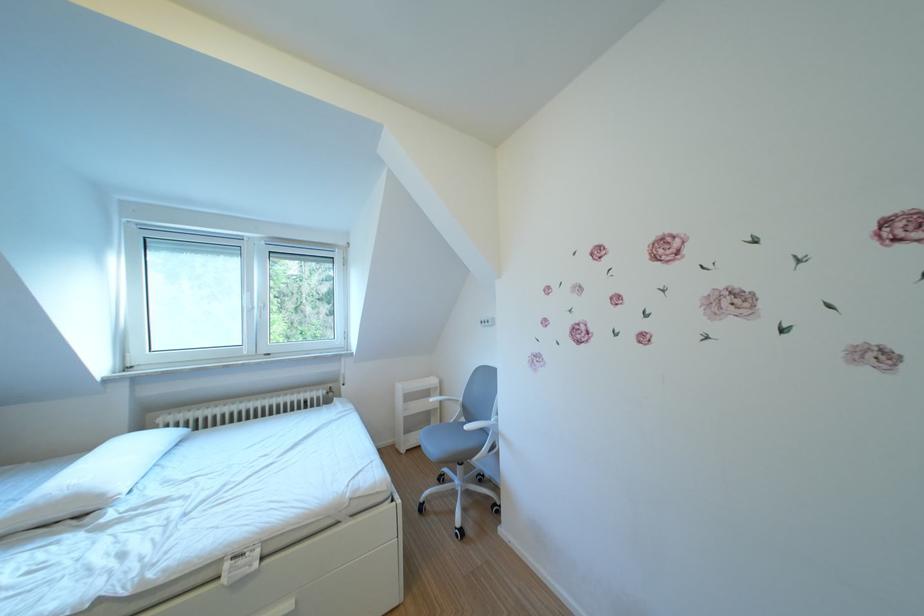
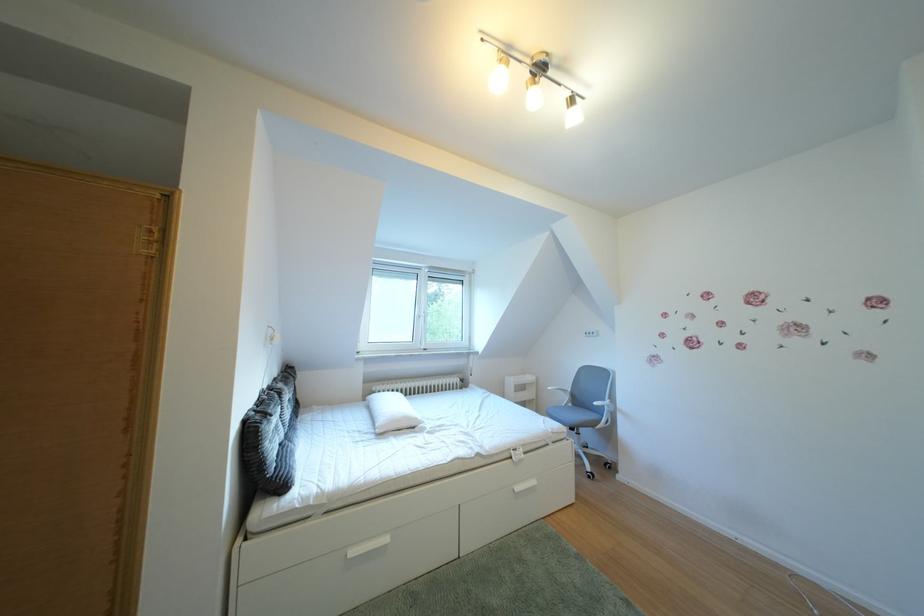
In a continuous first-person perspective shot, in which direction is the camera moving?

The cameraman walked toward left, backward.